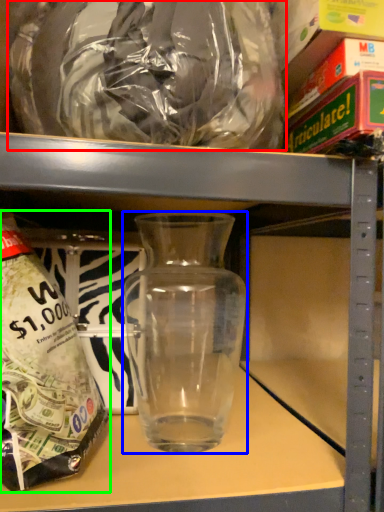
Question: Which object is the closest to the plastic bag (highlighted by a red box)? Choose among these: vase (highlighted by a blue box) or bottle (highlighted by a green box).

Choices:
 (A) vase
 (B) bottle

Answer: (B)